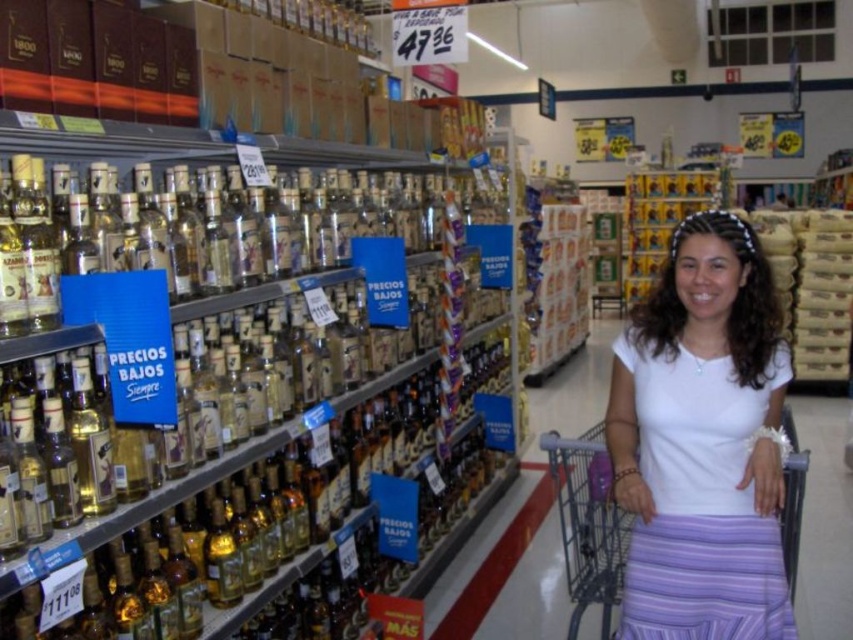
Question: Does white matte shirt at center appear over metallic gray shopping cart at lower right?

Choices:
 (A) yes
 (B) no

Answer: (A)

Question: Among these points, which one is nearest to the camera?

Choices:
 (A) (570, 572)
 (B) (645, 403)

Answer: (B)

Question: Which point appears farthest from the camera in this image?

Choices:
 (A) (554, 456)
 (B) (746, 609)

Answer: (A)

Question: Is white matte shirt at center positioned at the back of metallic gray shopping cart at lower right?

Choices:
 (A) yes
 (B) no

Answer: (B)

Question: Does white matte shirt at center appear over metallic gray shopping cart at lower right?

Choices:
 (A) yes
 (B) no

Answer: (A)

Question: Which point appears farthest from the camera in this image?

Choices:
 (A) (640, 545)
 (B) (544, 449)

Answer: (B)